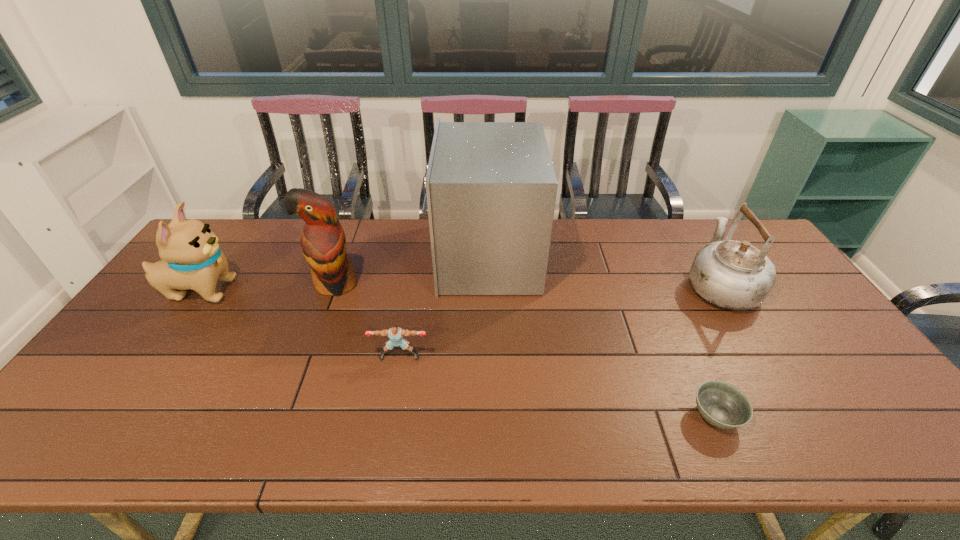
Identify the location of free space located 0.170m on the front panel of the toaster oven. (382, 257).

Locate an element on the screen. Image resolution: width=960 pixels, height=540 pixels. free region located 0.320m on the face of the second object from left to right is located at coordinates (295, 394).

Locate an element on the screen. The image size is (960, 540). free region located 0.120m on the face of the puppy is located at coordinates (277, 291).

In order to click on vacant region located 0.090m at the spout of the rightmost object in this screenshot , I will do `click(693, 241)`.

What are the coordinates of `vacant area located 0.210m at the spout of the rightmost object` in the screenshot? It's located at (682, 222).

Where is `vacant space located 0.050m at the spout of the rightmost object`? This screenshot has width=960, height=540. vacant space located 0.050m at the spout of the rightmost object is located at coordinates (698, 248).

At what (x,y) coordinates should I click in order to perform the action: click on vacant point located 0.150m on the front-facing side of the second nearest object. Please return your answer as a coordinate pair (x, y). Image resolution: width=960 pixels, height=540 pixels. Looking at the image, I should click on (390, 413).

The height and width of the screenshot is (540, 960). In order to click on vacant region located on the right of the shortest object in this screenshot , I will do `click(854, 416)`.

This screenshot has width=960, height=540. I want to click on toaster oven that is at the far edge, so click(x=490, y=187).

Where is `kettle that is positioned at the far edge`? kettle that is positioned at the far edge is located at coordinates (733, 275).